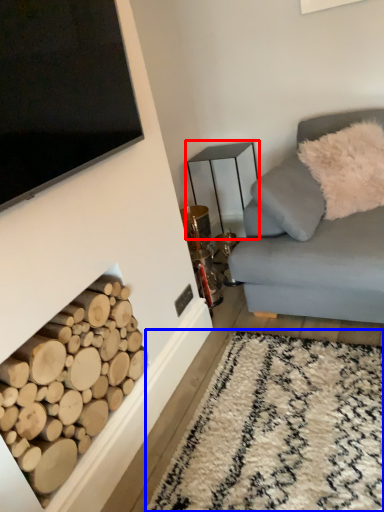
Question: Among these objects, which one is farthest to the camera, table (highlighted by a red box) or plain (highlighted by a blue box)?

Choices:
 (A) table
 (B) plain

Answer: (A)